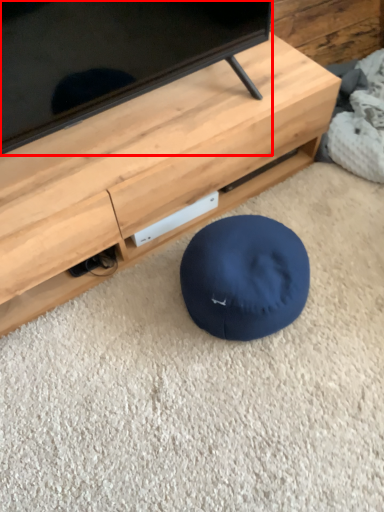
Question: From the image's perspective, what is the correct spatial relationship of television (annotated by the red box) in relation to furniture?

Choices:
 (A) below
 (B) above

Answer: (B)